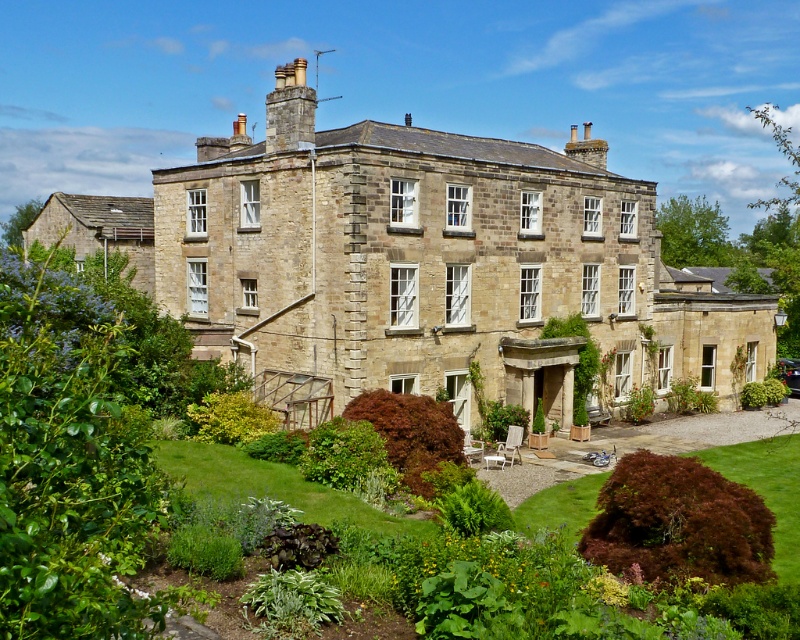
Who is lower down, green grass at lower left or stone chimney at upper center?

Positioned lower is green grass at lower left.

Based on the photo, does green grass at lower left appear over stone chimney at upper center?

No.

Is point (380, 512) positioned after point (277, 136)?

No, it is not.

Find the location of a particular element. This screenshot has height=640, width=800. green grass at lower left is located at coordinates (274, 486).

Is green grass at lower left bigger than green grass at lower right?

No, green grass at lower left is not bigger than green grass at lower right.

Between green grass at lower left and green grass at lower right, which one has more height?

Standing taller between the two is green grass at lower left.

The height and width of the screenshot is (640, 800). I want to click on green grass at lower left, so click(274, 486).

Can you confirm if green grass at lower right is bigger than stone chimney at upper center?

Incorrect, green grass at lower right is not larger than stone chimney at upper center.

Can you confirm if green grass at lower right is wider than stone chimney at upper center?

No.

Between point (780, 580) and point (289, 131), which one is positioned in front?

Point (780, 580) is in front.

The image size is (800, 640). In order to click on green grass at lower right in this screenshot , I will do `click(768, 490)`.